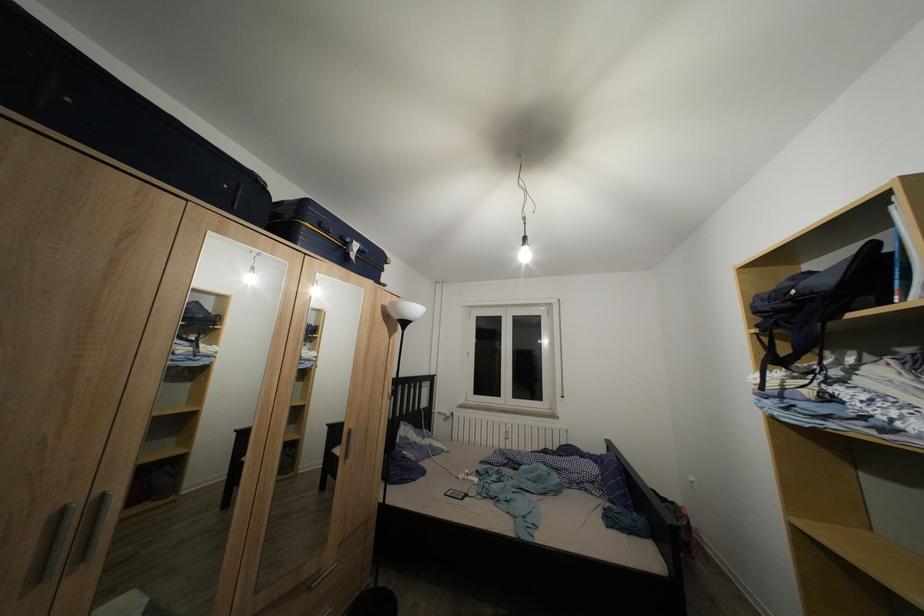
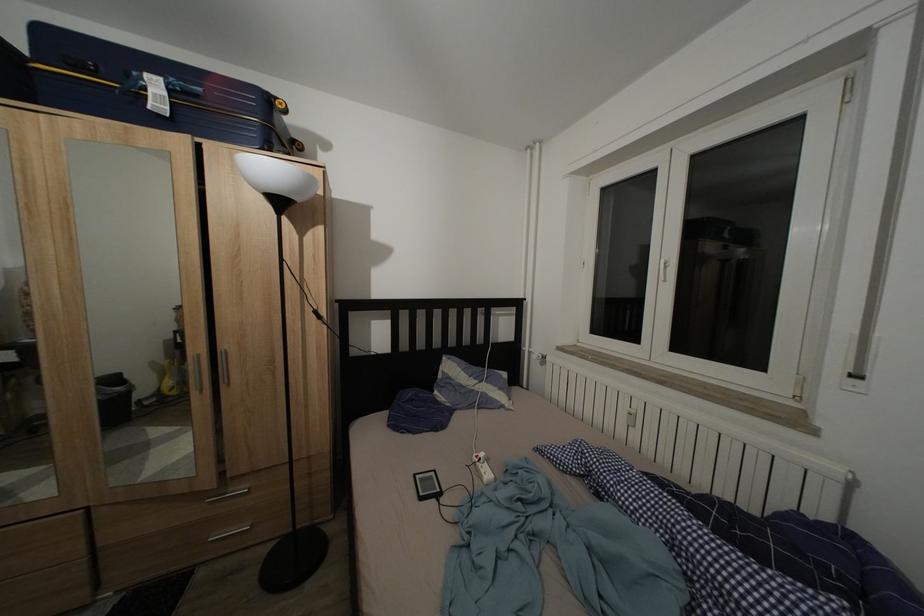
The point at (480, 488) is marked in the first image. Where is the corresponding point in the second image?

(488, 483)